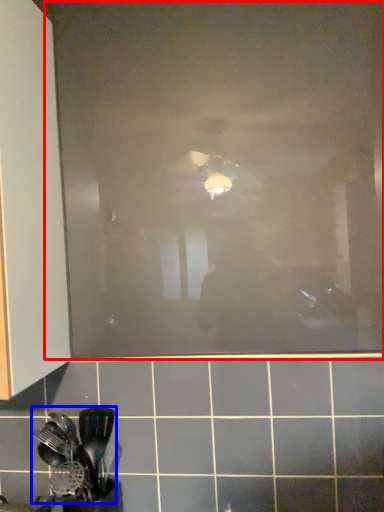
Question: Which point is closer to the camera, glass door (highlighted by a red box) or spatula (highlighted by a blue box)?

Choices:
 (A) glass door
 (B) spatula

Answer: (B)